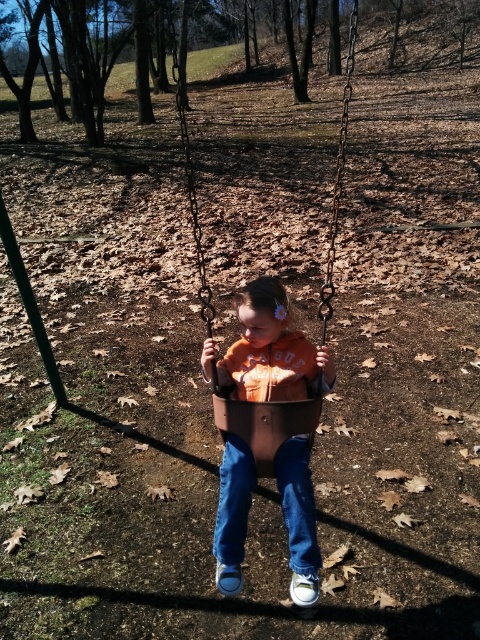
Between matte orange hoodie at center and denim at center, which one appears on the right side from the viewer's perspective?

Positioned to the right is matte orange hoodie at center.

Who is more forward, (288,492) or (296,460)?

Point (288,492) is more forward.

The height and width of the screenshot is (640, 480). Identify the location of matte orange hoodie at center. (272, 349).

In order to click on matte orange hoodie at center in this screenshot , I will do `click(272, 349)`.

Which is behind, point (235, 358) or point (180, 102)?

The point (180, 102) is behind.

Is matte orange hoodie at center below brown leather swing at center?

Correct, matte orange hoodie at center is located below brown leather swing at center.

The height and width of the screenshot is (640, 480). What do you see at coordinates (272, 349) in the screenshot?
I see `matte orange hoodie at center` at bounding box center [272, 349].

The height and width of the screenshot is (640, 480). I want to click on matte orange hoodie at center, so click(x=272, y=349).

Between point (332, 273) and point (305, 506), which one is positioned in front?

Point (305, 506) is more forward.

Which is behind, point (229, 420) or point (308, 468)?

Point (229, 420)

Which is behind, point (334, 212) or point (300, 520)?

The point (334, 212) is more distant.

The height and width of the screenshot is (640, 480). What are the coordinates of `brown leather swing at center` in the screenshot? It's located at (264, 420).